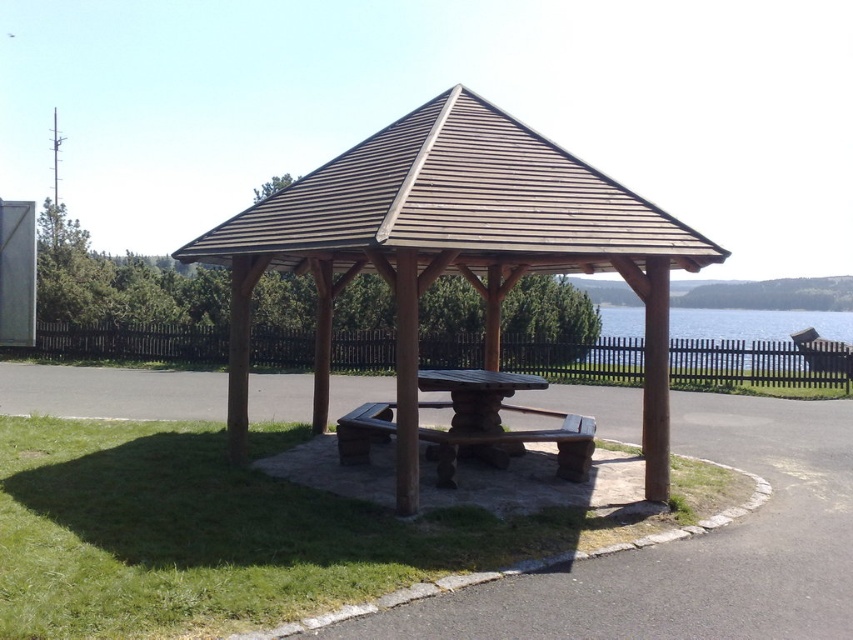
Question: Which point appears farthest from the camera in this image?

Choices:
 (A) (393, 433)
 (B) (238, 333)

Answer: (A)

Question: Which of the following is the closest to the observer?

Choices:
 (A) (561, 465)
 (B) (468, 426)
 (C) (398, 545)
 (D) (654, 477)

Answer: (C)

Question: Which object is closer to the camera taking this photo?

Choices:
 (A) rustic wood table at center
 (B) brown wooden gazebo at center
 (C) rustic wood bench at center

Answer: (C)

Question: Can you confirm if rustic wood bench at center is positioned to the left of rustic wood table at center?

Choices:
 (A) yes
 (B) no

Answer: (B)

Question: Is green grass at center wider than rustic wood table at center?

Choices:
 (A) yes
 (B) no

Answer: (B)

Question: Does brown wooden gazebo at center have a lesser width compared to rustic wood bench at center?

Choices:
 (A) no
 (B) yes

Answer: (B)